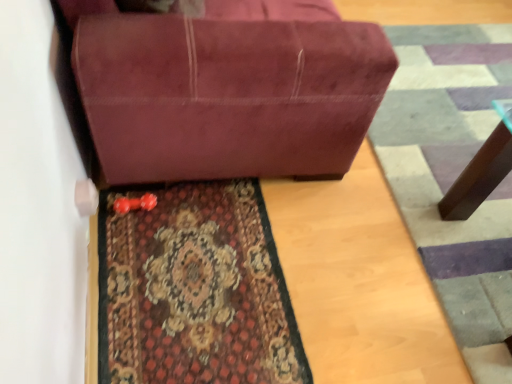
Question: Considering the positions of carpeted rug at lower center and suede-like maroon couch at center in the image, is carpeted rug at lower center taller or shorter than suede-like maroon couch at center?

Choices:
 (A) short
 (B) tall

Answer: (A)

Question: Considering the positions of point (133, 339) and point (229, 77), is point (133, 339) closer or farther from the camera than point (229, 77)?

Choices:
 (A) closer
 (B) farther

Answer: (B)

Question: Considering the real-world distances, which object is farthest from the carpeted doormat at lower right?

Choices:
 (A) suede-like maroon couch at center
 (B) carpeted rug at lower center

Answer: (B)

Question: Which is farther from the carpeted rug at lower center?

Choices:
 (A) suede-like maroon couch at center
 (B) carpeted doormat at lower right

Answer: (B)